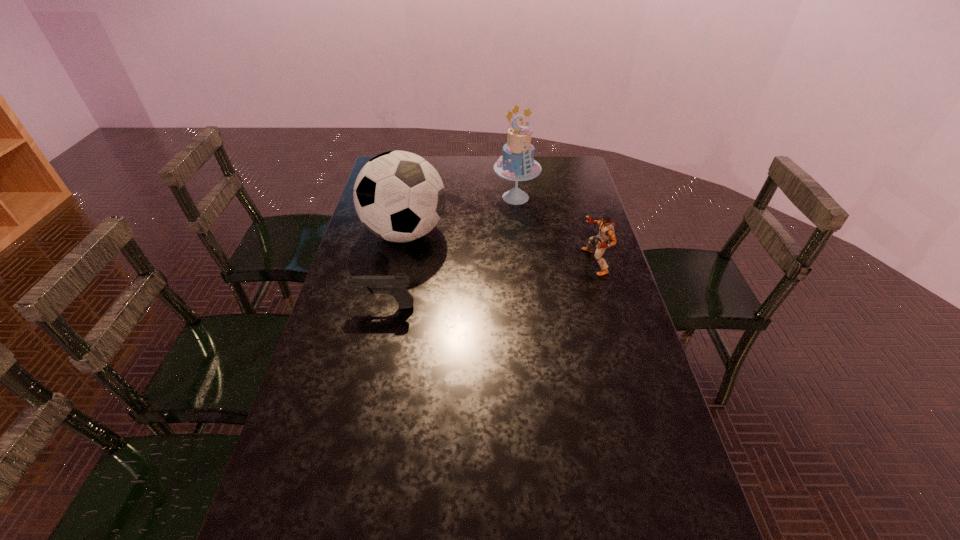
Where is `vacant area between the nearest object and the soccer ball`? vacant area between the nearest object and the soccer ball is located at coordinates (395, 269).

In order to click on free spot between the second shortest object and the pistol in this screenshot , I will do `click(490, 284)`.

Where is `free area in between the second object from right to left and the shortest object`? The image size is (960, 540). free area in between the second object from right to left and the shortest object is located at coordinates (450, 252).

Image resolution: width=960 pixels, height=540 pixels. What are the coordinates of `object that is the second closest one to the third shortest object` in the screenshot? It's located at (396, 285).

I want to click on object that stands as the second closest to the tallest object, so click(606, 230).

The width and height of the screenshot is (960, 540). What are the coordinates of `free point that satisfies the following two spatial constraints: 1. on the back side of the tallest object; 2. on the left side of the second tallest object` in the screenshot? It's located at (413, 197).